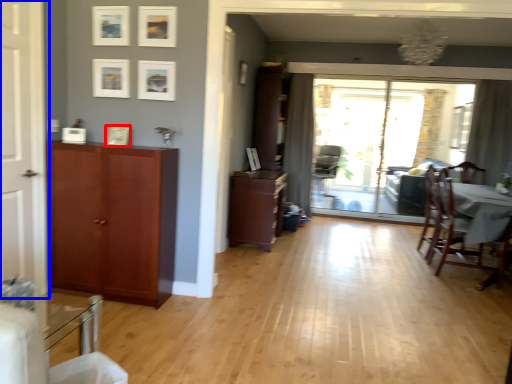
Question: Which object appears farthest to the camera in this image, picture frame (highlighted by a red box) or door (highlighted by a blue box)?

Choices:
 (A) picture frame
 (B) door

Answer: (A)